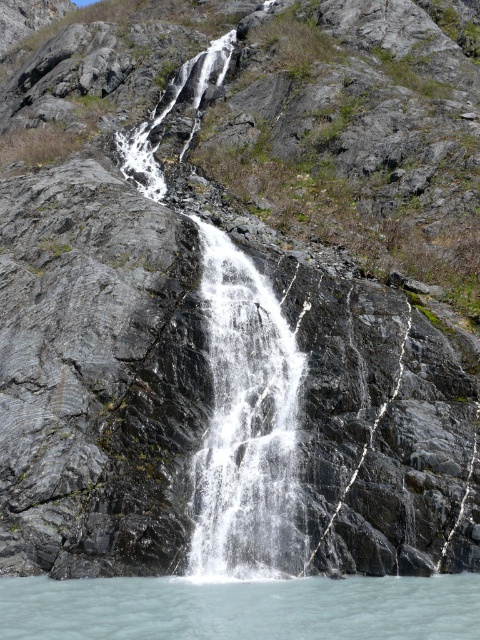
You are a photographer standing at the camera position. You want to capture a closeup shot of the white frothy water at center. Given that your camera can focus on objects within 20 meters, will you be able to take the photo without moving closer?

The white frothy water at center and camera are 20.62 meters apart from each other. Since the camera can only focus within 20 meters, you are 0.62 meters beyond the focus range. Therefore, you will need to move closer to take the closeup shot.

You are a hiker who wants to cross the waterfall area. You see the white frothy water at center and the clear water at lower center. Which one is higher and would make it harder to step over?

The white frothy water at center is higher than the clear water at lower center, making it harder to step over.